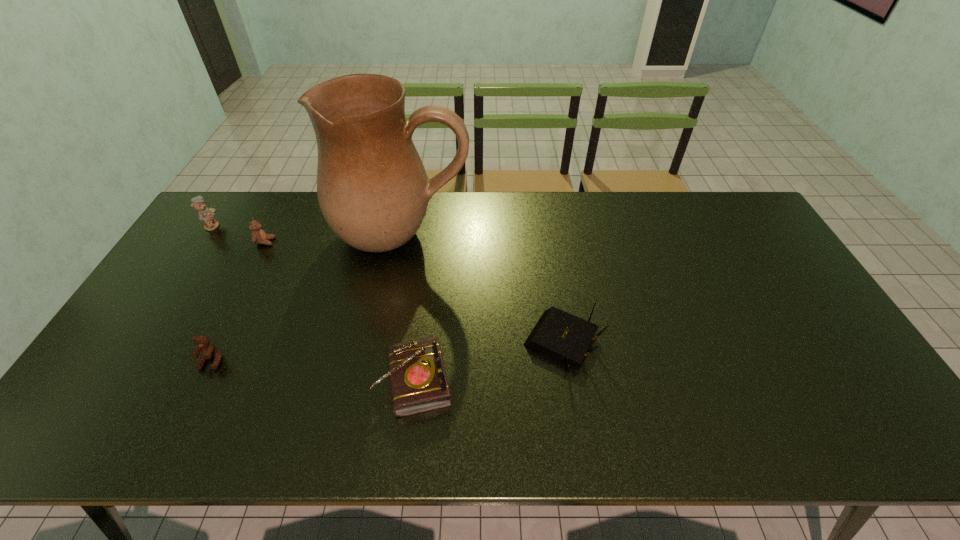
Identify which object is the fifth closest to the shortest object. Please provide its 2D coordinates. Your answer should be formatted as a tuple, i.e. [(x, y)], where the tuple contains the x and y coordinates of a point satisfying the conditions above.

[(205, 214)]

Where is `the second closest object to the second farthest teddy bear`? The width and height of the screenshot is (960, 540). the second closest object to the second farthest teddy bear is located at coordinates (373, 190).

Locate an element on the screen. Image resolution: width=960 pixels, height=540 pixels. the closest teddy bear to the second nearest teddy bear is located at coordinates (205, 214).

What are the coordinates of `teddy bear that is the second closest one to the second nearest teddy bear` in the screenshot? It's located at (209, 351).

You are a GUI agent. You are given a task and a screenshot of the screen. Output one action in this format:
    pyautogui.click(x=<x>, y=<y>)
    Task: Click on the vacant space that satisfies the following two spatial constraints: 1. on the front-facing side of the tallest teddy bear; 2. on the left side of the shortest object
    The width and height of the screenshot is (960, 540).
    Given the screenshot: What is the action you would take?
    pyautogui.click(x=109, y=381)

Where is `blank area in the image that satisfies the following two spatial constraints: 1. on the front-facing side of the router; 2. on the left side of the second farthest teddy bear`? This screenshot has height=540, width=960. blank area in the image that satisfies the following two spatial constraints: 1. on the front-facing side of the router; 2. on the left side of the second farthest teddy bear is located at coordinates (214, 342).

In order to click on free space that satisfies the following two spatial constraints: 1. on the front-facing side of the second farthest teddy bear; 2. on the right side of the diary in this screenshot , I will do 195,381.

You are a GUI agent. You are given a task and a screenshot of the screen. Output one action in this format:
    pyautogui.click(x=<x>, y=<y>)
    Task: Click on the vacant space that satisfies the following two spatial constraints: 1. on the front-facing side of the router; 2. on the right side of the second nearest teddy bear
    The height and width of the screenshot is (540, 960).
    Given the screenshot: What is the action you would take?
    pyautogui.click(x=214, y=342)

Where is `blank space that satisfies the following two spatial constraints: 1. at the spout of the cream pitcher; 2. on the right side of the rightmost object`? blank space that satisfies the following two spatial constraints: 1. at the spout of the cream pitcher; 2. on the right side of the rightmost object is located at coordinates (381, 342).

The height and width of the screenshot is (540, 960). What are the coordinates of `free space that satisfies the following two spatial constraints: 1. at the spout of the rightmost object; 2. on the left side of the tallest object` in the screenshot? It's located at (381, 342).